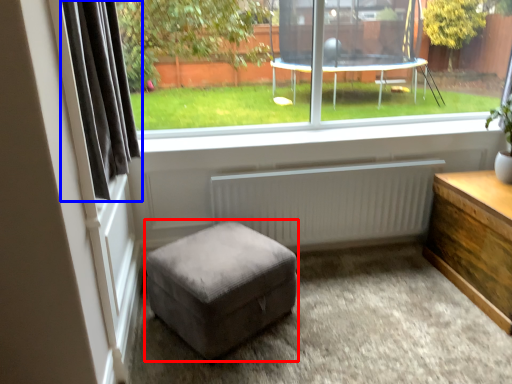
Question: Which of the following is the farthest to the observer, stool (highlighted by a red box) or curtain (highlighted by a blue box)?

Choices:
 (A) stool
 (B) curtain

Answer: (A)